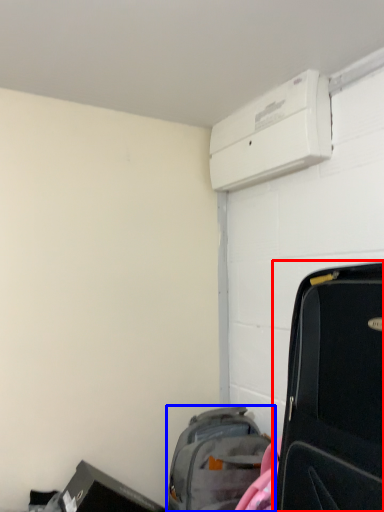
Question: Among these objects, which one is farthest to the camera, suitcase (highlighted by a red box) or luggage and bags (highlighted by a blue box)?

Choices:
 (A) suitcase
 (B) luggage and bags

Answer: (B)